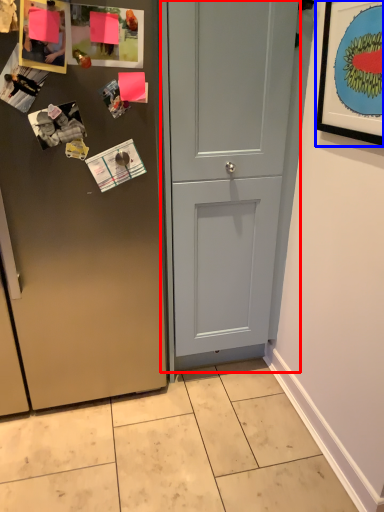
Question: Which of the following is the farthest to the observer, door (highlighted by a red box) or picture frame (highlighted by a blue box)?

Choices:
 (A) door
 (B) picture frame

Answer: (A)